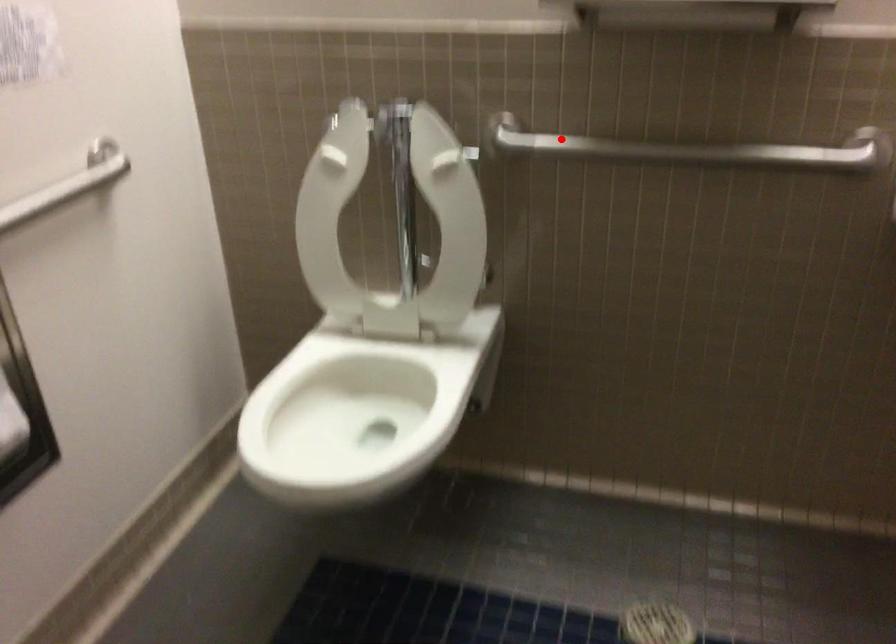
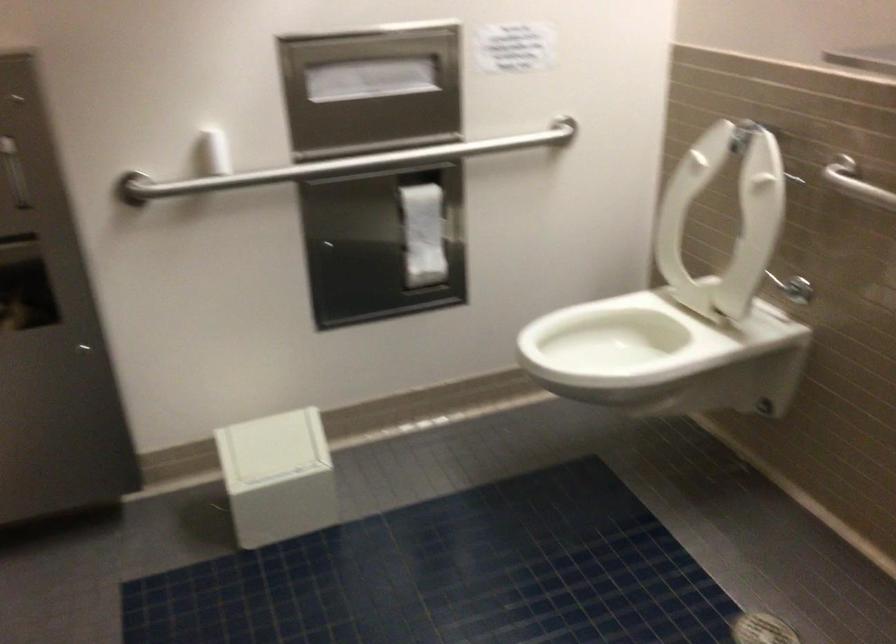
The point at the highlighted location is marked in the first image. Where is the corresponding point in the second image?

(856, 183)